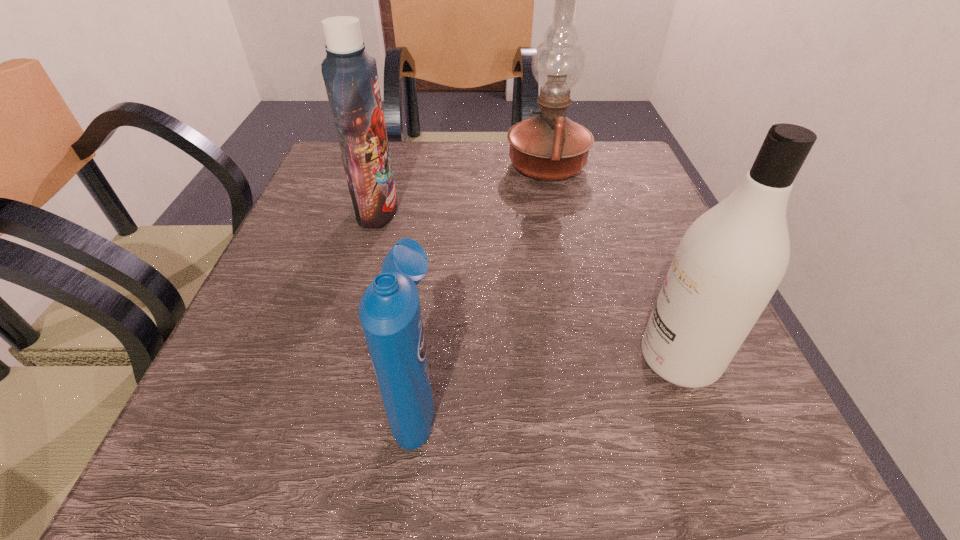
Where is `oil lamp`? This screenshot has height=540, width=960. oil lamp is located at coordinates (550, 146).

Find the location of `the leftmost object`. the leftmost object is located at coordinates (350, 75).

You are a GUI agent. You are given a task and a screenshot of the screen. Output one action in this format:
    pyautogui.click(x=<x>, y=<y>)
    Task: Click on the leftmost shampoo
    The height and width of the screenshot is (540, 960).
    Given the screenshot: What is the action you would take?
    pyautogui.click(x=350, y=75)

The image size is (960, 540). Find the location of `the rightmost shampoo`. the rightmost shampoo is located at coordinates (729, 263).

I want to click on the shortest object, so click(390, 313).

Where is `the shortest shampoo`? the shortest shampoo is located at coordinates (390, 313).

Where is `free space located 0.390m on the left of the oil lamp`? The image size is (960, 540). free space located 0.390m on the left of the oil lamp is located at coordinates (341, 166).

Locate an element on the screen. free space located on the front label of the leftmost shampoo is located at coordinates (493, 211).

The height and width of the screenshot is (540, 960). I want to click on free space located 0.160m on the front-facing side of the rightmost shampoo, so click(x=531, y=359).

Where is `blank space located 0.080m on the front-facing side of the rightmost shampoo`? blank space located 0.080m on the front-facing side of the rightmost shampoo is located at coordinates (585, 359).